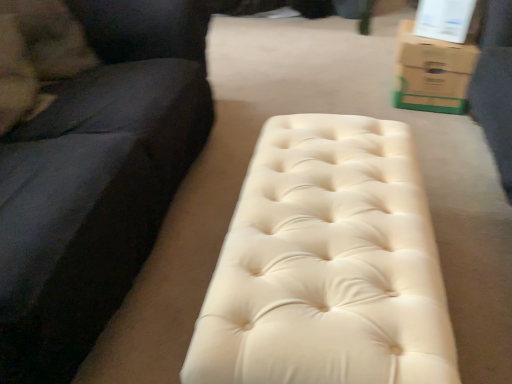
Where is `suede black studio couch at left`? The image size is (512, 384). suede black studio couch at left is located at coordinates (88, 163).

The width and height of the screenshot is (512, 384). What do you see at coordinates (432, 73) in the screenshot?
I see `brown cardboard box at upper right` at bounding box center [432, 73].

Locate an element on the screen. suede black studio couch at left is located at coordinates (88, 163).

The image size is (512, 384). I want to click on cardboard box below the creamy leather bench at center (from a real-world perspective), so click(432, 73).

Looking at this image, would you consider brown cardboard box at upper right to be distant from creamy leather bench at center?

Yes.

Is brown cardboard box at upper right positioned behind creamy leather bench at center?

That is True.

Could creamy leather bench at center be considered to be inside brown cardboard box at upper right?

No, creamy leather bench at center is not a part of brown cardboard box at upper right.

Which is more to the left, brown cardboard box at upper right or suede black studio couch at left?

Positioned to the left is suede black studio couch at left.

Based on the photo, could you tell me if brown cardboard box at upper right is turned towards suede black studio couch at left?

No, brown cardboard box at upper right does not turn towards suede black studio couch at left.

What's the angular difference between brown cardboard box at upper right and suede black studio couch at left's facing directions?

There is a 171-degree angle between the facing directions of brown cardboard box at upper right and suede black studio couch at left.

Looking at this image, can we say brown cardboard box at upper right lies outside suede black studio couch at left?

brown cardboard box at upper right is positioned outside suede black studio couch at left.

From the image's perspective, is suede black studio couch at left on brown cardboard box at upper right?

Incorrect, from the image's perspective, suede black studio couch at left is lower than brown cardboard box at upper right.

In the image, there is a suede black studio couch at left. Where is `cardboard box below it (from a real-world perspective)`? cardboard box below it (from a real-world perspective) is located at coordinates (432, 73).

Considering the sizes of objects suede black studio couch at left and brown cardboard box at upper right in the image provided, who is wider, suede black studio couch at left or brown cardboard box at upper right?

Wider between the two is suede black studio couch at left.

From the picture: Considering the relative sizes of creamy leather bench at center and suede black studio couch at left in the image provided, is creamy leather bench at center thinner than suede black studio couch at left?

Indeed, creamy leather bench at center has a lesser width compared to suede black studio couch at left.

Looking at this image, from a real-world perspective, who is located higher, creamy leather bench at center or suede black studio couch at left?

suede black studio couch at left, from a real-world perspective.

Is creamy leather bench at center touching suede black studio couch at left?

creamy leather bench at center and suede black studio couch at left are not in contact.

Looking at the image, does creamy leather bench at center seem bigger or smaller compared to suede black studio couch at left?

In the image, creamy leather bench at center appears to be smaller than suede black studio couch at left.

I want to click on furniture on the right of suede black studio couch at left, so 327,264.

Measure the distance between suede black studio couch at left and creamy leather bench at center.

suede black studio couch at left is 52.99 centimeters away from creamy leather bench at center.

Is the surface of suede black studio couch at left in direct contact with creamy leather bench at center?

They are not placed beside each other.

From the image's perspective, is suede black studio couch at left positioned above or below creamy leather bench at center?

Based on their image positions, suede black studio couch at left is located above creamy leather bench at center.

Would you say creamy leather bench at center is to the left or to the right of brown cardboard box at upper right in the picture?

creamy leather bench at center is positioned on brown cardboard box at upper right's left side.

Is creamy leather bench at center touching brown cardboard box at upper right?

creamy leather bench at center and brown cardboard box at upper right are clearly separated.

Between creamy leather bench at center and brown cardboard box at upper right, which one is positioned in front?

creamy leather bench at center.

From the image's perspective, would you say creamy leather bench at center is shown under brown cardboard box at upper right?

Yes, from the image's perspective, creamy leather bench at center is beneath brown cardboard box at upper right.

Locate an element on the screen. cardboard box located above the creamy leather bench at center (from the image's perspective) is located at coordinates (432, 73).

Find the location of a particular element. studio couch below the brown cardboard box at upper right (from the image's perspective) is located at coordinates (88, 163).

From the image, which object appears to be nearer to brown cardboard box at upper right, suede black studio couch at left or creamy leather bench at center?

creamy leather bench at center.

When comparing their distances from brown cardboard box at upper right, does creamy leather bench at center or suede black studio couch at left seem closer?

The object closer to brown cardboard box at upper right is creamy leather bench at center.

Looking at the image, which one is located further to suede black studio couch at left, brown cardboard box at upper right or creamy leather bench at center?

Based on the image, brown cardboard box at upper right appears to be further to suede black studio couch at left.

Which object lies nearer to the anchor point creamy leather bench at center, brown cardboard box at upper right or suede black studio couch at left?

suede black studio couch at left is closer to creamy leather bench at center.

From the image, which object appears to be farther from suede black studio couch at left, creamy leather bench at center or brown cardboard box at upper right?

Among the two, brown cardboard box at upper right is located further to suede black studio couch at left.

Based on their spatial positions, is suede black studio couch at left or brown cardboard box at upper right further from creamy leather bench at center?

The object further to creamy leather bench at center is brown cardboard box at upper right.

Where is `furniture between suede black studio couch at left and brown cardboard box at upper right in the horizontal direction`? The image size is (512, 384). furniture between suede black studio couch at left and brown cardboard box at upper right in the horizontal direction is located at coordinates tap(327, 264).